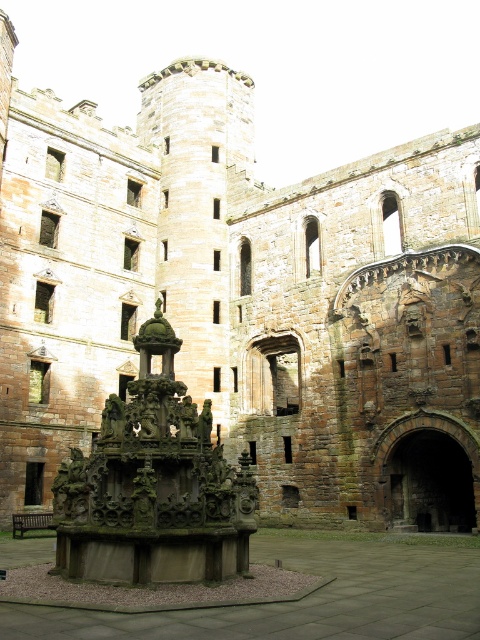
Measure the distance from dark stone fountain at center to stone fountain at center.

dark stone fountain at center is 7.70 meters away from stone fountain at center.

This screenshot has height=640, width=480. Find the location of `dark stone fountain at center`. dark stone fountain at center is located at coordinates (154, 484).

Which is behind, point (235, 566) or point (2, 625)?

Positioned behind is point (235, 566).

Where is `dark stone fountain at center`? The image size is (480, 640). dark stone fountain at center is located at coordinates (154, 484).